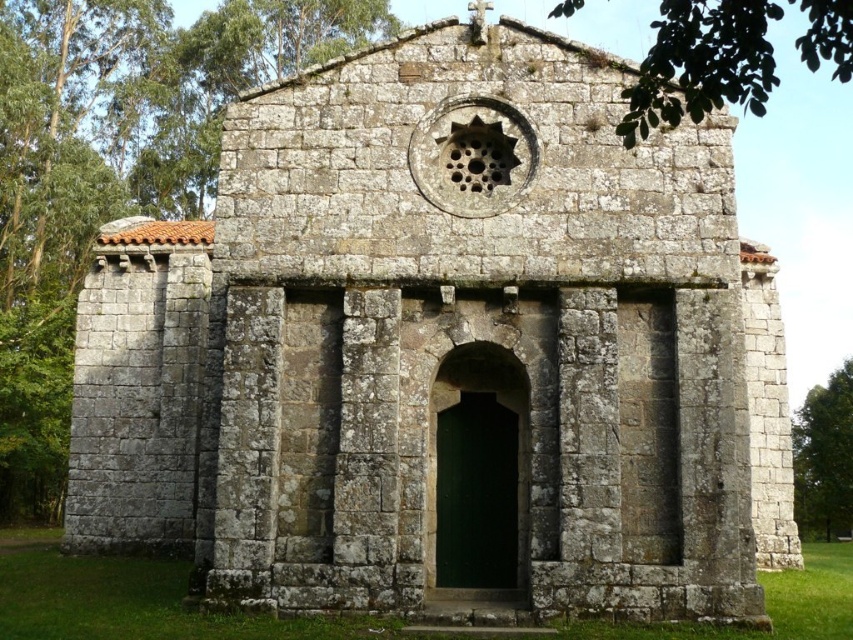
You are standing at the entrance of the ancient stone chapel and see two points marked in the scene. The first point is at coordinates point [697,3] and the second point is at point [846,496]. Which point is closer to you as you face the chapel?

Point [697,3] is closer to you because it is in front of point [846,496].